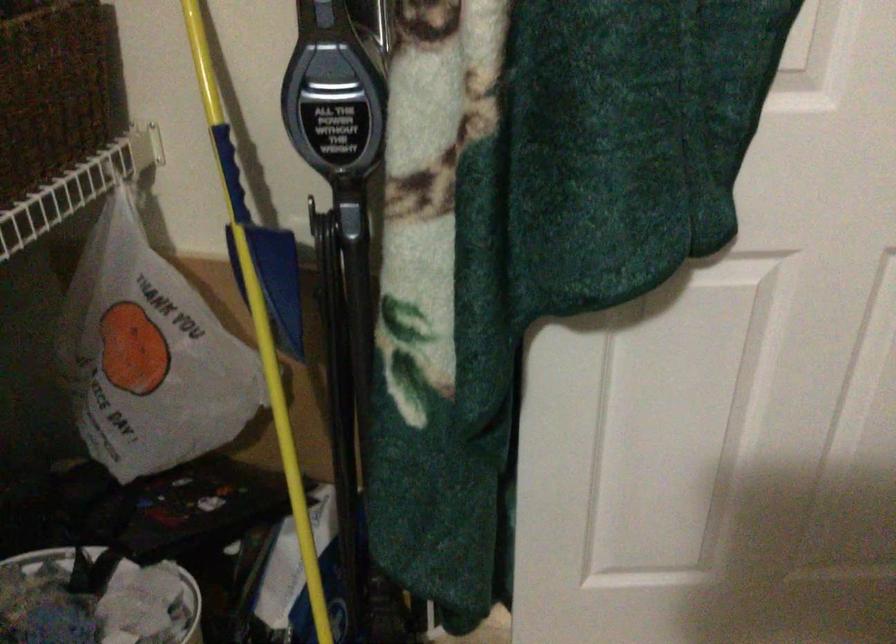
Find where to grip the yellow pole handle. Please return your answer as a coordinate pair (x, y).

(213, 44)